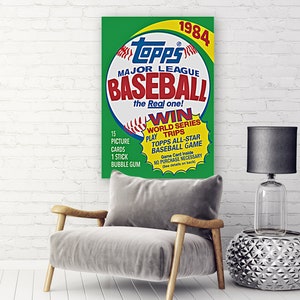
The width and height of the screenshot is (300, 300). Find the location of `poster`. poster is located at coordinates (116, 38).